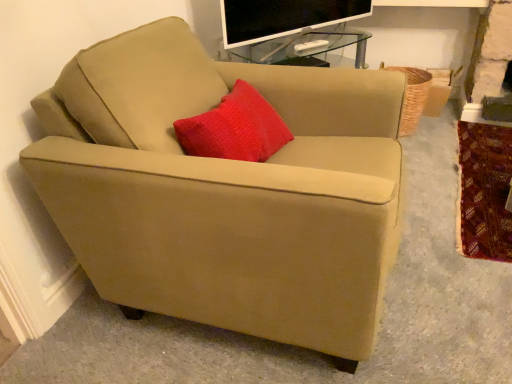
Describe the element at coordinates (412, 97) in the screenshot. The width and height of the screenshot is (512, 384). I see `woven brown basket at right` at that location.

In order to face suede beige armchair at center, should I rotate leftwards or rightwards?

Rotate left and turn 1.268 degrees.

This screenshot has width=512, height=384. In order to click on flat-screen tv at upper center in this screenshot , I will do `click(283, 17)`.

You are a GUI agent. You are given a task and a screenshot of the screen. Output one action in this format:
    pyautogui.click(x=<x>, y=<y>)
    Task: Click on the woven brown basket at right
    This screenshot has width=512, height=384.
    Given the screenshot: What is the action you would take?
    pyautogui.click(x=412, y=97)

The image size is (512, 384). Identify the location of television behind the velvet-like red blanket at lower right. (283, 17).

Based on the photo, could velvet-like red blanket at lower right be considered to be inside flat-screen tv at upper center?

No, flat-screen tv at upper center does not contain velvet-like red blanket at lower right.

From a real-world perspective, is flat-screen tv at upper center above or below velvet-like red blanket at lower right?

flat-screen tv at upper center is situated higher than velvet-like red blanket at lower right in the real world.

Could you tell me if velvet-like red blanket at lower right is turned towards woven brown basket at right?

No, velvet-like red blanket at lower right does not turn towards woven brown basket at right.

Looking at this image, which is more to the left, velvet-like red blanket at lower right or woven brown basket at right?

woven brown basket at right.

From a real-world perspective, between velvet-like red blanket at lower right and woven brown basket at right, who is vertically higher?

woven brown basket at right is physically above.

From the image's perspective, which one is positioned lower, velvet-like red blanket at lower right or woven brown basket at right?

From the image's view, velvet-like red blanket at lower right is below.

Looking at this image, is suede beige armchair at center inside or outside of flat-screen tv at upper center?

suede beige armchair at center is outside flat-screen tv at upper center.

How many degrees apart are the facing directions of suede beige armchair at center and flat-screen tv at upper center?

37.2 degrees separate the facing orientations of suede beige armchair at center and flat-screen tv at upper center.

From the image's perspective, which is above, suede beige armchair at center or flat-screen tv at upper center?

From the image's view, flat-screen tv at upper center is above.

Is suede beige armchair at center not close to flat-screen tv at upper center?

No.

From the image's perspective, is woven brown basket at right below flat-screen tv at upper center?

Indeed, from the image's perspective, woven brown basket at right is shown beneath flat-screen tv at upper center.

Is woven brown basket at right facing away from flat-screen tv at upper center?

No.

Which is behind, point (414, 93) or point (225, 44)?

Positioned behind is point (414, 93).

Where is `basket below the flat-screen tv at upper center (from a real-world perspective)`? This screenshot has width=512, height=384. basket below the flat-screen tv at upper center (from a real-world perspective) is located at coordinates (412, 97).

Who is bigger, woven brown basket at right or suede beige armchair at center?

With larger size is suede beige armchair at center.

Can you see woven brown basket at right touching suede beige armchair at center?

No.

Can you confirm if woven brown basket at right is positioned to the left of suede beige armchair at center?

Incorrect, woven brown basket at right is not on the left side of suede beige armchair at center.

Is suede beige armchair at center at the back of woven brown basket at right?

No.

Does woven brown basket at right contain velvet-like red blanket at lower right?

Definitely not — velvet-like red blanket at lower right is not inside woven brown basket at right.

Considering the relative positions of woven brown basket at right and velvet-like red blanket at lower right in the image provided, is woven brown basket at right to the right of velvet-like red blanket at lower right from the viewer's perspective?

In fact, woven brown basket at right is to the left of velvet-like red blanket at lower right.

Considering the sizes of woven brown basket at right and velvet-like red blanket at lower right in the image, is woven brown basket at right bigger or smaller than velvet-like red blanket at lower right?

In the image, woven brown basket at right appears to be larger than velvet-like red blanket at lower right.

Could you tell me if woven brown basket at right is turned towards velvet-like red blanket at lower right?

No, woven brown basket at right is not facing towards velvet-like red blanket at lower right.

The width and height of the screenshot is (512, 384). Identify the location of television above the velvet-like red blanket at lower right (from the image's perspective). (283, 17).

Which is in front, point (468, 157) or point (228, 40)?

Positioned in front is point (228, 40).

Could you tell me if velvet-like red blanket at lower right is facing flat-screen tv at upper center?

No, velvet-like red blanket at lower right is not oriented towards flat-screen tv at upper center.

Does velvet-like red blanket at lower right appear on the left side of flat-screen tv at upper center?

No.

At what (x,y) coordinates should I click in order to perform the action: click on television above the velvet-like red blanket at lower right (from the image's perspective). Please return your answer as a coordinate pair (x, y). Looking at the image, I should click on (283, 17).

Locate an element on the screen. blanket that is in front of the woven brown basket at right is located at coordinates (485, 191).

Consider the image. Considering their positions, is flat-screen tv at upper center positioned closer to suede beige armchair at center than woven brown basket at right?

flat-screen tv at upper center.

Looking at the image, which one is located closer to flat-screen tv at upper center, suede beige armchair at center or velvet-like red blanket at lower right?

Based on the image, suede beige armchair at center appears to be nearer to flat-screen tv at upper center.

Estimate the real-world distances between objects in this image. Which object is closer to velvet-like red blanket at lower right, flat-screen tv at upper center or woven brown basket at right?

woven brown basket at right lies closer to velvet-like red blanket at lower right than the other object.

Considering their positions, is woven brown basket at right positioned closer to flat-screen tv at upper center than suede beige armchair at center?

woven brown basket at right lies closer to flat-screen tv at upper center than the other object.

Looking at the image, which one is located closer to woven brown basket at right, suede beige armchair at center or flat-screen tv at upper center?

flat-screen tv at upper center.

Based on their spatial positions, is woven brown basket at right or flat-screen tv at upper center further from velvet-like red blanket at lower right?

The object further to velvet-like red blanket at lower right is flat-screen tv at upper center.

Considering their positions, is velvet-like red blanket at lower right positioned closer to suede beige armchair at center than woven brown basket at right?

velvet-like red blanket at lower right.

Based on the photo, which object lies nearer to the anchor point woven brown basket at right, flat-screen tv at upper center or suede beige armchair at center?

The object closer to woven brown basket at right is flat-screen tv at upper center.

Image resolution: width=512 pixels, height=384 pixels. What are the coordinates of `television between suede beige armchair at center and velvet-like red blanket at lower right` in the screenshot? It's located at (283, 17).

The height and width of the screenshot is (384, 512). I want to click on television between suede beige armchair at center and woven brown basket at right in the front-back direction, so click(283, 17).

Identify the location of basket between flat-screen tv at upper center and velvet-like red blanket at lower right in the horizontal direction. This screenshot has width=512, height=384. (412, 97).

Identify the location of blanket between suede beige armchair at center and woven brown basket at right from front to back. (485, 191).